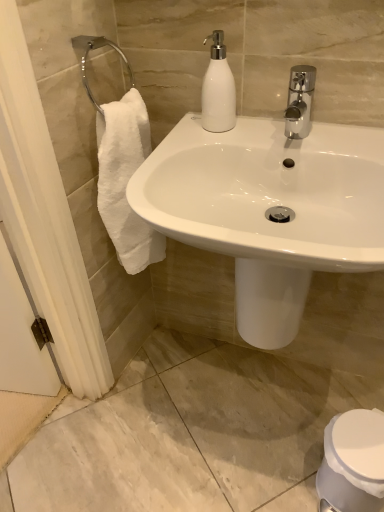
What is the approximate width of white glossy toilet at lower right?

white glossy toilet at lower right is 8.75 inches in width.

Describe the element at coordinates (353, 461) in the screenshot. This screenshot has height=512, width=384. I see `white glossy toilet at lower right` at that location.

Find the location of a particular element. The image size is (384, 512). white glossy toilet at lower right is located at coordinates (353, 461).

Describe the element at coordinates (218, 89) in the screenshot. Image resolution: width=384 pixels, height=512 pixels. I see `white glossy soap dispenser at upper center` at that location.

Identify the location of white glossy soap dispenser at upper center. The height and width of the screenshot is (512, 384). (218, 89).

You are a GUI agent. You are given a task and a screenshot of the screen. Output one action in this format:
    pyautogui.click(x=<x>, y=<y>)
    Task: Click on the white glossy toilet at lower right
    Image resolution: width=384 pixels, height=512 pixels.
    Given the screenshot: What is the action you would take?
    pyautogui.click(x=353, y=461)

Considering the positions of objects white glossy toilet at lower right and white glossy soap dispenser at upper center in the image provided, who is more to the left, white glossy toilet at lower right or white glossy soap dispenser at upper center?

From the viewer's perspective, white glossy soap dispenser at upper center appears more on the left side.

Is white glossy toilet at lower right positioned behind white glossy soap dispenser at upper center?

Yes, it is.

Is point (319, 487) behind point (228, 105)?

Yes, point (319, 487) is behind point (228, 105).

From the image's perspective, which object appears higher, white glossy toilet at lower right or white glossy soap dispenser at upper center?

white glossy soap dispenser at upper center, from the image's perspective.

From a real-world perspective, which is physically above, white glossy toilet at lower right or white glossy soap dispenser at upper center?

white glossy soap dispenser at upper center, from a real-world perspective.

Considering the relative sizes of white glossy toilet at lower right and white glossy soap dispenser at upper center in the image provided, is white glossy toilet at lower right thinner than white glossy soap dispenser at upper center?

Incorrect, the width of white glossy toilet at lower right is not less than that of white glossy soap dispenser at upper center.

Who is taller, white glossy toilet at lower right or white glossy soap dispenser at upper center?

white glossy toilet at lower right.

Is white glossy toilet at lower right bigger or smaller than white glossy soap dispenser at upper center?

Considering their sizes, white glossy toilet at lower right takes up more space than white glossy soap dispenser at upper center.

Which is correct: white glossy toilet at lower right is inside white glossy soap dispenser at upper center, or outside of it?

white glossy toilet at lower right exists outside the volume of white glossy soap dispenser at upper center.

Does white glossy toilet at lower right touch white glossy soap dispenser at upper center?

There is a gap between white glossy toilet at lower right and white glossy soap dispenser at upper center.

Is white glossy toilet at lower right looking in the opposite direction of white glossy soap dispenser at upper center?

white glossy toilet at lower right does not have its back to white glossy soap dispenser at upper center.

How different are the orientations of white glossy toilet at lower right and white glossy soap dispenser at upper center in degrees?

They differ by 11.5 degrees in their facing directions.

This screenshot has height=512, width=384. In order to click on soap dispenser that is in front of the white glossy toilet at lower right in this screenshot , I will do `click(218, 89)`.

Which object is positioned more to the right, white glossy soap dispenser at upper center or white glossy toilet at lower right?

white glossy toilet at lower right.

Is white glossy soap dispenser at upper center positioned before white glossy toilet at lower right?

Yes, white glossy soap dispenser at upper center is in front of white glossy toilet at lower right.

Is point (210, 123) closer or farther from the camera than point (342, 489)?

Point (210, 123) is positioned closer to the camera compared to point (342, 489).

From the image's perspective, is white glossy soap dispenser at upper center positioned above or below white glossy toilet at lower right?

white glossy soap dispenser at upper center is situated higher than white glossy toilet at lower right in the image.

From a real-world perspective, who is located lower, white glossy soap dispenser at upper center or white glossy toilet at lower right?

white glossy toilet at lower right, from a real-world perspective.

Does white glossy soap dispenser at upper center have a lesser width compared to white glossy toilet at lower right?

Yes.

Considering the relative sizes of white glossy soap dispenser at upper center and white glossy toilet at lower right in the image provided, is white glossy soap dispenser at upper center shorter than white glossy toilet at lower right?

Correct, white glossy soap dispenser at upper center is not as tall as white glossy toilet at lower right.

Does white glossy soap dispenser at upper center have a larger size compared to white glossy toilet at lower right?

Actually, white glossy soap dispenser at upper center might be smaller than white glossy toilet at lower right.

Is white glossy soap dispenser at upper center located outside white glossy toilet at lower right?

Yes, white glossy soap dispenser at upper center is outside of white glossy toilet at lower right.

Consider the image. Would you consider white glossy soap dispenser at upper center to be distant from white glossy toilet at lower right?

No, there isn't a large distance between white glossy soap dispenser at upper center and white glossy toilet at lower right.

Could you tell me if white glossy soap dispenser at upper center is turned towards white glossy toilet at lower right?

No, white glossy soap dispenser at upper center is not aimed at white glossy toilet at lower right.

Could you measure the distance between white glossy soap dispenser at upper center and white glossy toilet at lower right?

The distance of white glossy soap dispenser at upper center from white glossy toilet at lower right is 32.02 inches.

Locate an element on the screen. This screenshot has width=384, height=512. toilet below the white glossy soap dispenser at upper center (from the image's perspective) is located at coordinates (353, 461).

This screenshot has height=512, width=384. In order to click on soap dispenser in front of the white glossy toilet at lower right in this screenshot , I will do `click(218, 89)`.

At what (x,y) coordinates should I click in order to perform the action: click on toilet below the white glossy soap dispenser at upper center (from a real-world perspective). Please return your answer as a coordinate pair (x, y). Looking at the image, I should click on (353, 461).